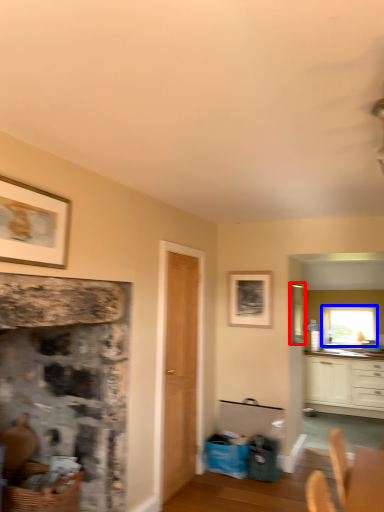
Question: Which point is closer to the camera, window screen (highlighted by a red box) or window (highlighted by a blue box)?

Choices:
 (A) window screen
 (B) window

Answer: (A)